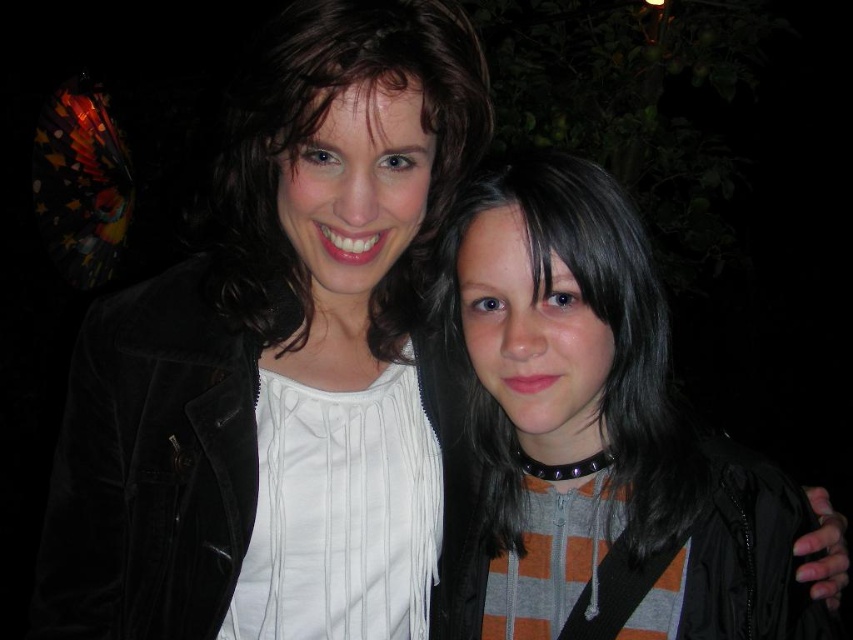
Does orange striped hoodie at center appear on the right side of matte black jacket at upper left?

Correct, you'll find orange striped hoodie at center to the right of matte black jacket at upper left.

Does orange striped hoodie at center have a greater width compared to matte black jacket at upper left?

Yes, orange striped hoodie at center is wider than matte black jacket at upper left.

Does point (770, 490) come in front of point (239, 163)?

No, it is not.

You are a GUI agent. You are given a task and a screenshot of the screen. Output one action in this format:
    pyautogui.click(x=<x>, y=<y>)
    Task: Click on the orange striped hoodie at center
    
    Given the screenshot: What is the action you would take?
    pyautogui.click(x=599, y=435)